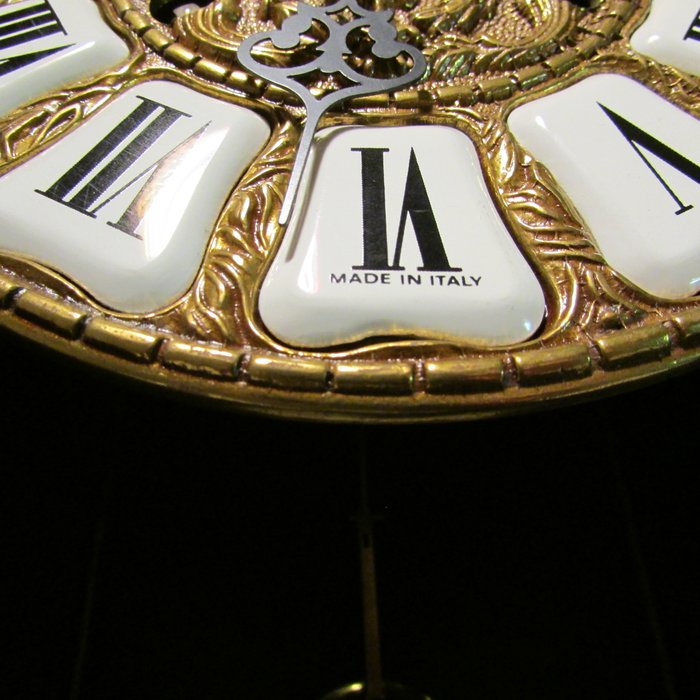
Identify the location of clock hand. (323, 50).